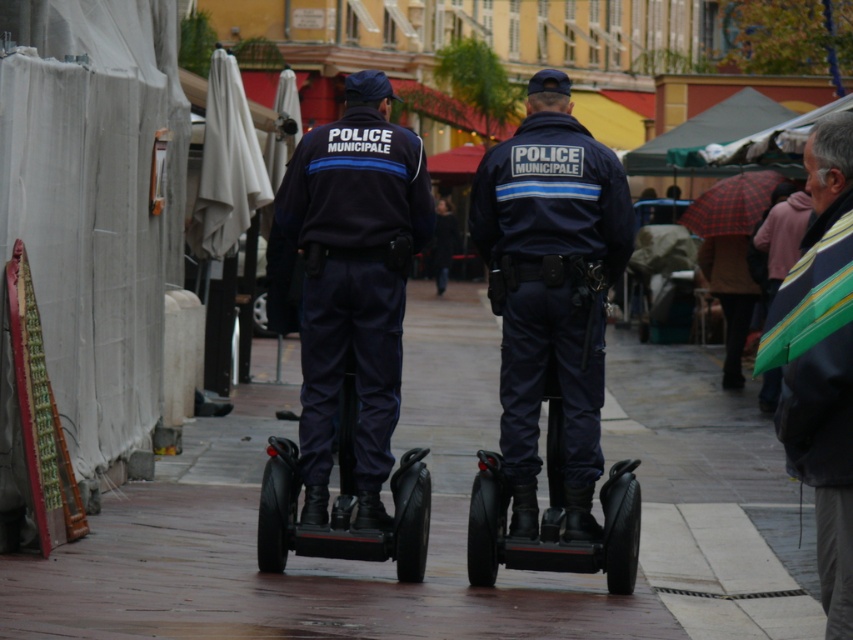
Question: Considering the real-world distances, which object is farthest from the striped fabric umbrella at lower right?

Choices:
 (A) dark blue uniform at center
 (B) black rubber segway at center
 (C) navy blue uniform at center

Answer: (B)

Question: Is the position of navy blue uniform at center more distant than that of striped fabric umbrella at lower right?

Choices:
 (A) no
 (B) yes

Answer: (B)

Question: Is navy blue uniform at center bigger than striped fabric umbrella at lower right?

Choices:
 (A) yes
 (B) no

Answer: (B)

Question: Which object is positioned farthest from the dark blue uniform at center?

Choices:
 (A) black rubber segway at center
 (B) striped fabric umbrella at lower right
 (C) navy blue uniform at center

Answer: (A)

Question: Which is nearer to the navy blue uniform at center?

Choices:
 (A) striped fabric umbrella at lower right
 (B) black rubber segway at center
 (C) dark blue uniform at center

Answer: (C)

Question: Does navy blue uniform at center have a larger size compared to dark blue uniform at center?

Choices:
 (A) yes
 (B) no

Answer: (B)